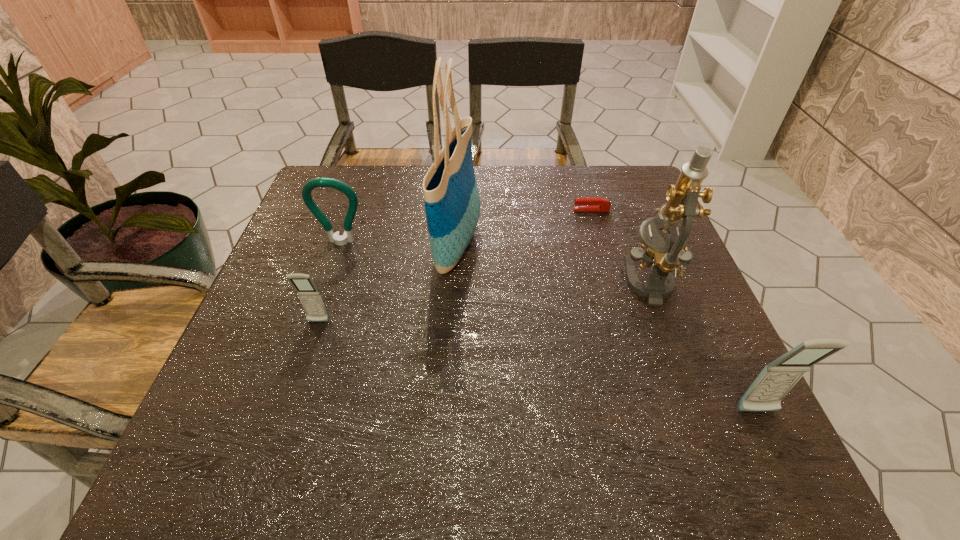
Select which object is the fifth closest to the bottle opener. Please provide its 2D coordinates. Your answer should be formatted as a tuple, i.e. [(x, y)], where the tuple contains the x and y coordinates of a point satisfying the conditions above.

[(765, 394)]

Locate which object is the third closest to the right cellular telephone. Please provide its 2D coordinates. Your answer should be formatted as a tuple, i.e. [(x, y)], where the tuple contains the x and y coordinates of a point satisfying the conditions above.

[(589, 203)]

The height and width of the screenshot is (540, 960). I want to click on free location that satisfies the following two spatial constraints: 1. at the jaws of the bottle opener; 2. on the right side of the second tallest object, so click(327, 283).

Identify the location of vacant space that satisfies the following two spatial constraints: 1. on the front-facing side of the stapler; 2. at the jaws of the bottle opener. (601, 243).

Locate an element on the screen. free spot that satisfies the following two spatial constraints: 1. on the front-facing side of the shortest object; 2. on the front-facing side of the second nearest object is located at coordinates (625, 322).

Locate an element on the screen. free space in the image that satisfies the following two spatial constraints: 1. on the front-facing side of the microscope; 2. on the right side of the stapler is located at coordinates (613, 283).

I want to click on free space that satisfies the following two spatial constraints: 1. on the front-facing side of the microscope; 2. on the right side of the stapler, so click(x=613, y=283).